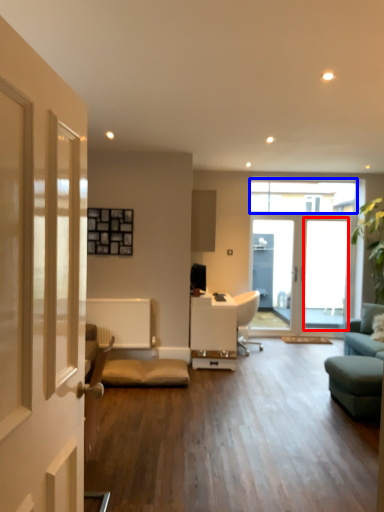
Question: Which point is closer to the camera, window screen (highlighted by a red box) or window (highlighted by a blue box)?

Choices:
 (A) window screen
 (B) window

Answer: (A)